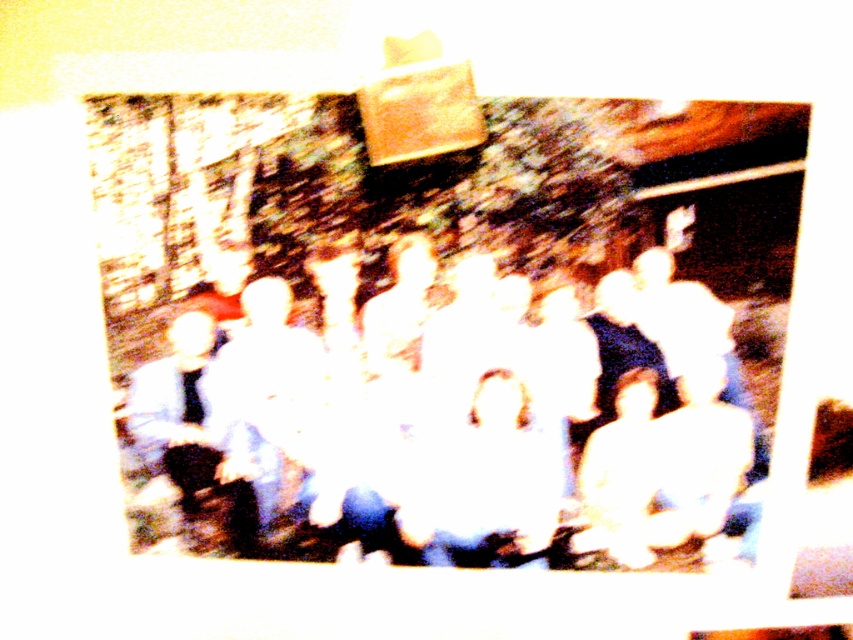
Is white cotton shirt at center further to the viewer compared to white matte shirt at left?

No, white cotton shirt at center is closer to the viewer.

Is white cotton shirt at center wider than white matte shirt at left?

Yes, white cotton shirt at center is wider than white matte shirt at left.

Between point (740, 428) and point (264, 509), which one is positioned in front?

Positioned in front is point (740, 428).

Where is `white cotton shirt at center`? The height and width of the screenshot is (640, 853). white cotton shirt at center is located at coordinates (462, 426).